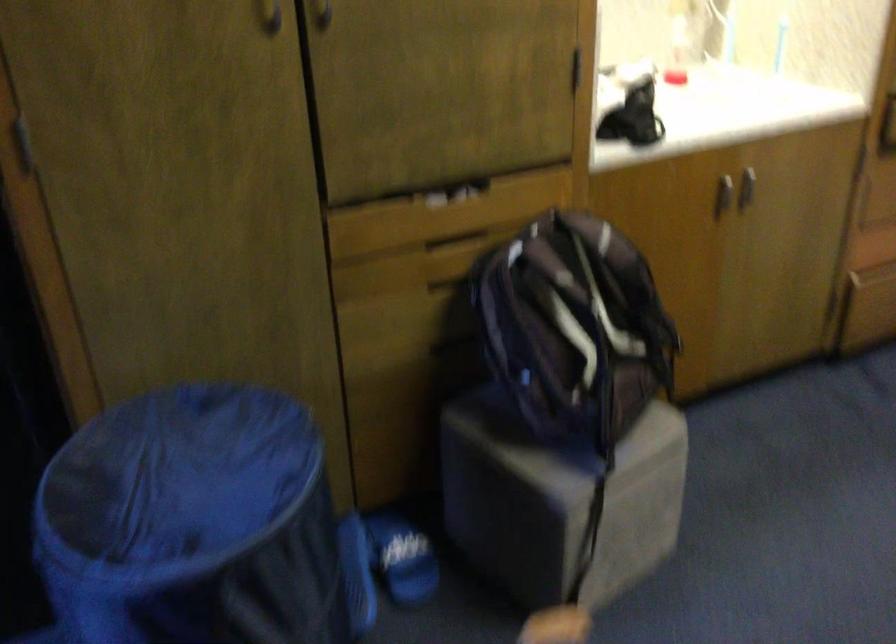
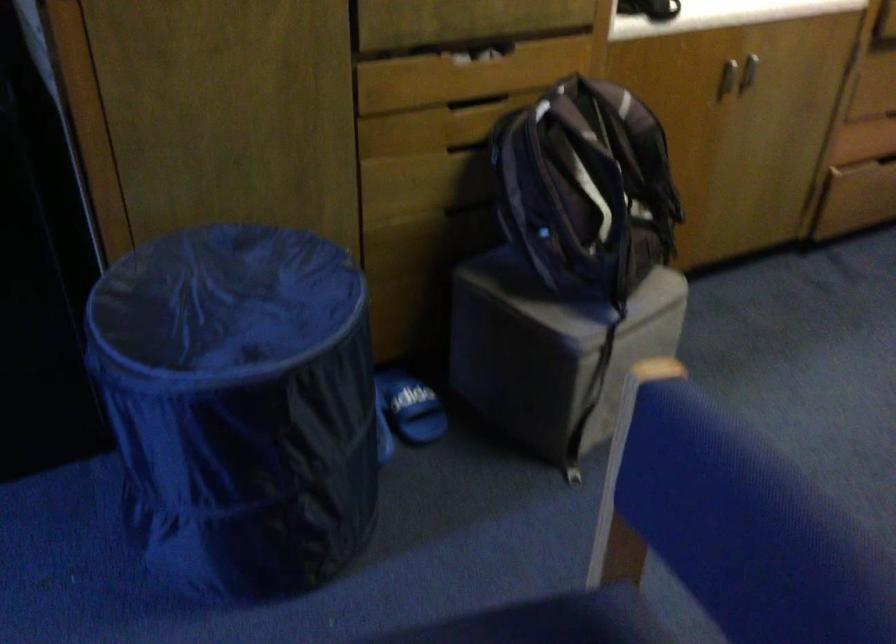
Where in the second image is the point corresponding to (401,558) from the first image?

(410, 406)